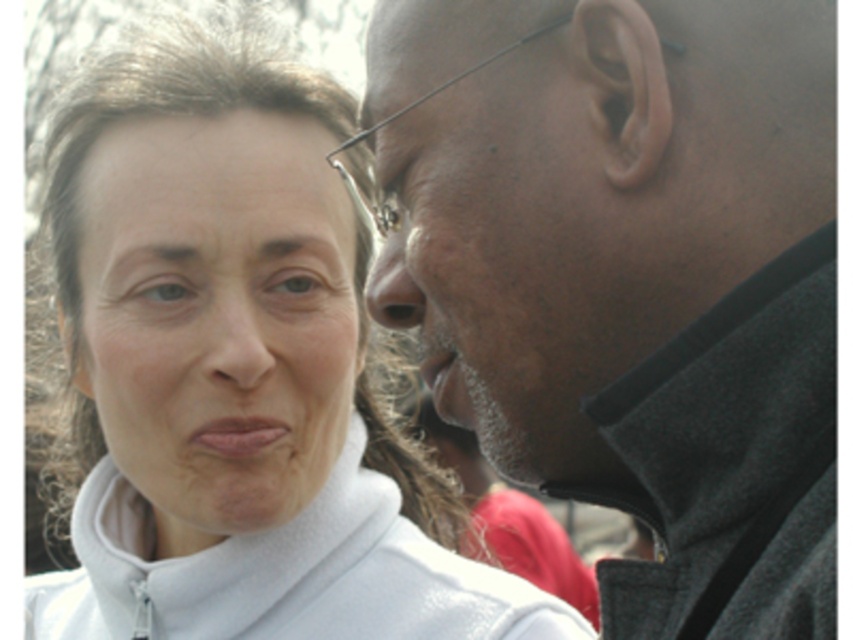
Question: Which object is farther from the camera taking this photo?

Choices:
 (A) white matte face at upper left
 (B) smooth skin forehead at upper center
 (C) gray fleece jacket at right
 (D) smooth skin face at right

Answer: (B)

Question: Which point is farther from the camera taking this photo?

Choices:
 (A) (693, 148)
 (B) (263, 209)
 (C) (341, 634)

Answer: (B)

Question: Is white matte face at upper left wider than matte skin nose at center?

Choices:
 (A) no
 (B) yes

Answer: (B)

Question: Does gray fleece jacket at right have a smaller size compared to smooth skin nose at center?

Choices:
 (A) yes
 (B) no

Answer: (B)

Question: Among these objects, which one is farthest from the camera?

Choices:
 (A) smooth skin face at right
 (B) white matte face at upper left
 (C) white matte jacket at center
 (D) smooth skin forehead at upper center

Answer: (D)

Question: Is smooth skin forehead at upper center positioned at the back of matte skin nose at center?

Choices:
 (A) yes
 (B) no

Answer: (A)